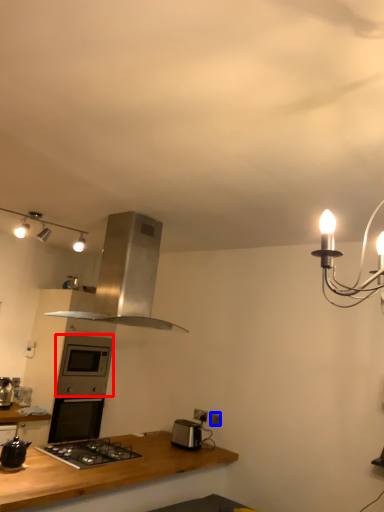
Question: Among these objects, which one is farthest to the camera, oven (highlighted by a red box) or electric outlet (highlighted by a blue box)?

Choices:
 (A) oven
 (B) electric outlet

Answer: (A)